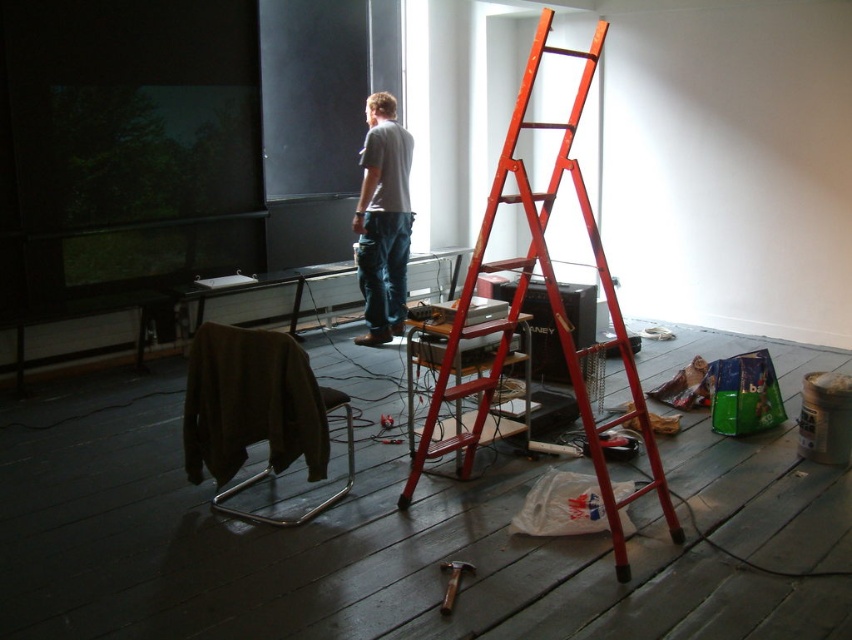
Question: Does gray cotton shirt at center appear on the left side of wooden hammer at center?

Choices:
 (A) no
 (B) yes

Answer: (B)

Question: Which object appears closest to the camera in this image?

Choices:
 (A) orange metallic ladder at center
 (B) gray cotton shirt at center
 (C) wooden hammer at center

Answer: (C)

Question: Is orange metallic ladder at center closer to camera compared to wooden hammer at center?

Choices:
 (A) no
 (B) yes

Answer: (A)

Question: Is gray cotton shirt at center to the right of wooden hammer at center from the viewer's perspective?

Choices:
 (A) no
 (B) yes

Answer: (A)

Question: Which object appears closest to the camera in this image?

Choices:
 (A) gray cotton shirt at center
 (B) orange metallic ladder at center
 (C) wooden hammer at center

Answer: (C)

Question: Among these points, which one is nearest to the camera?

Choices:
 (A) (459, 477)
 (B) (452, 582)
 (C) (403, 266)

Answer: (B)